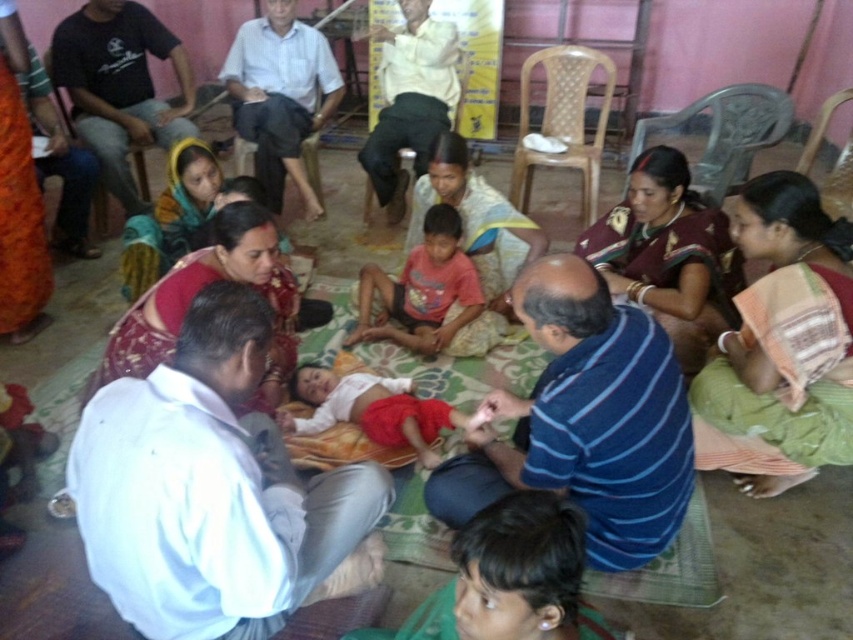
Does point (152, 45) come closer to viewer compared to point (253, 124)?

No, it is not.

At what (x,y) coordinates should I click in order to perform the action: click on black cotton shirt at upper left. Please return your answer as a coordinate pair (x, y). Image resolution: width=853 pixels, height=640 pixels. Looking at the image, I should click on (119, 86).

Does blue striped shirt at center have a lesser height compared to red cotton shirt at center?

Incorrect, blue striped shirt at center's height does not fall short of red cotton shirt at center's.

Does blue striped shirt at center have a greater width compared to red cotton shirt at center?

Yes, blue striped shirt at center is wider than red cotton shirt at center.

Is point (625, 481) positioned before point (422, 237)?

Yes, it is.

Identify the location of blue striped shirt at center. (585, 420).

Between light blue shirt at center and light yellow shirt at upper center, which one is positioned lower?

Positioned lower is light blue shirt at center.

Who is more distant from viewer, (265, 125) or (375, 156)?

Positioned behind is point (265, 125).

I want to click on light blue shirt at center, so click(280, 93).